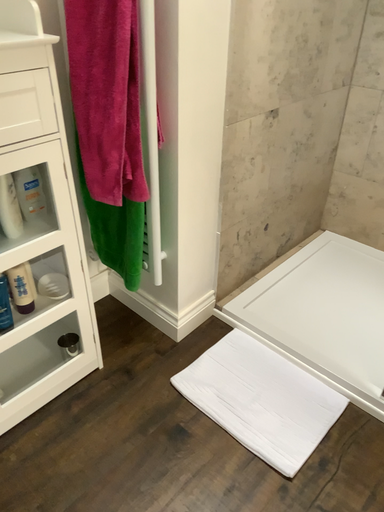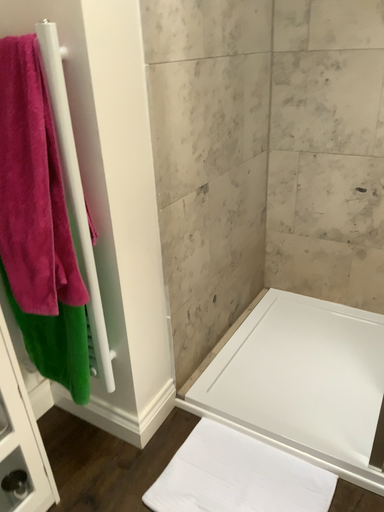
Question: How did the camera likely rotate when shooting the video?

Choices:
 (A) rotated left
 (B) rotated right

Answer: (B)